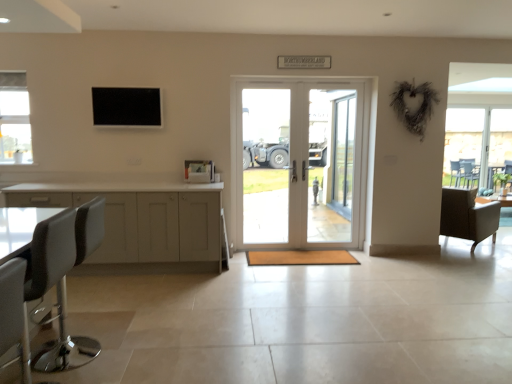
Question: Would you say leather-like brown armchair at right, which appears as the first chair when viewed from the right, is to the left or to the right of black leather swivel chair at lower left in the picture?

Choices:
 (A) right
 (B) left

Answer: (A)

Question: Considering the positions of leather-like brown armchair at right, positioned as the 2th chair in left-to-right order, and black leather swivel chair at lower left in the image, is leather-like brown armchair at right, positioned as the 2th chair in left-to-right order, taller or shorter than black leather swivel chair at lower left?

Choices:
 (A) short
 (B) tall

Answer: (A)

Question: Estimate the real-world distances between objects in this image. Which object is farther from the white matte cabinet at left?

Choices:
 (A) white glossy door at center
 (B) leather-like brown armchair at right, which appears as the first chair when viewed from the right
 (C) black leather swivel chair at lower left
 (D) clear glass door at center
 (E) clear glass window at upper left

Answer: (B)

Question: Considering the real-world distances, which object is farthest from the white matte cabinet at left?

Choices:
 (A) white glossy door at center
 (B) clear glass door at center
 (C) clear glass window at upper left
 (D) black leather swivel chair at lower left
 (E) white leather bar stool at left, positioned as the 2th chair in back-to-front order

Answer: (D)